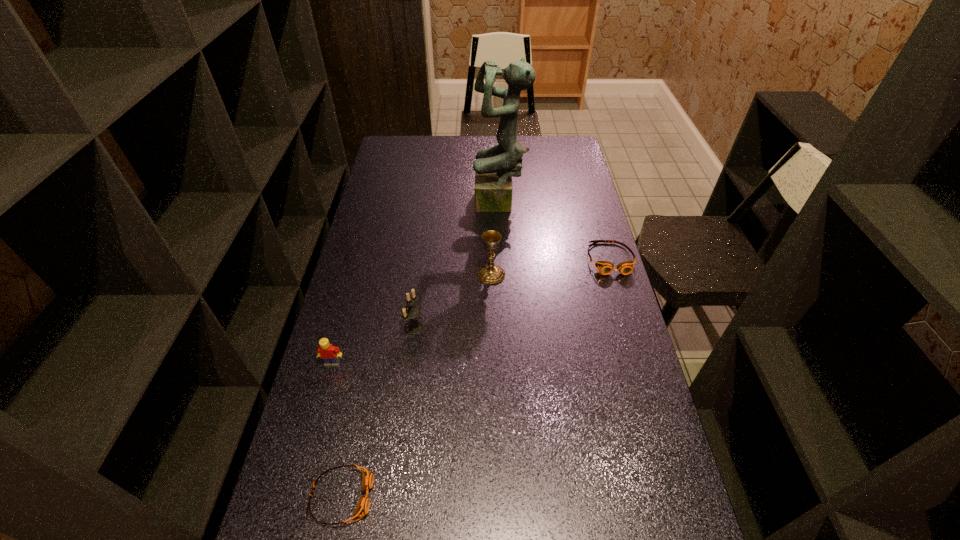
Find the location of a particular element. The height and width of the screenshot is (540, 960). goggles situated at the left edge is located at coordinates point(362,508).

Locate an element on the screen. Lego situated at the left edge is located at coordinates (330, 354).

Find the location of a particular element. The image size is (960, 540). object present at the right edge is located at coordinates (604, 267).

Where is `object situated at the near left corner`? This screenshot has height=540, width=960. object situated at the near left corner is located at coordinates (362, 508).

Identify the location of free space at the near edge. The width and height of the screenshot is (960, 540). (373, 531).

You are a GUI agent. You are given a task and a screenshot of the screen. Output one action in this format:
    pyautogui.click(x=<x>, y=<y>)
    Task: Click on the free space at the left edge
    Image resolution: width=960 pixels, height=540 pixels.
    Given the screenshot: What is the action you would take?
    pyautogui.click(x=367, y=224)

Locate an element on the screen. free space at the right edge is located at coordinates (594, 350).

The width and height of the screenshot is (960, 540). In the image, there is a desktop. What are the coordinates of `vacant region at the far left corner` in the screenshot? It's located at (390, 153).

Image resolution: width=960 pixels, height=540 pixels. Identify the location of vacant space in between the third nearest object and the Lego. (373, 346).

Locate an element on the screen. Image resolution: width=960 pixels, height=540 pixels. blank region between the rightmost object and the farthest object is located at coordinates (555, 232).